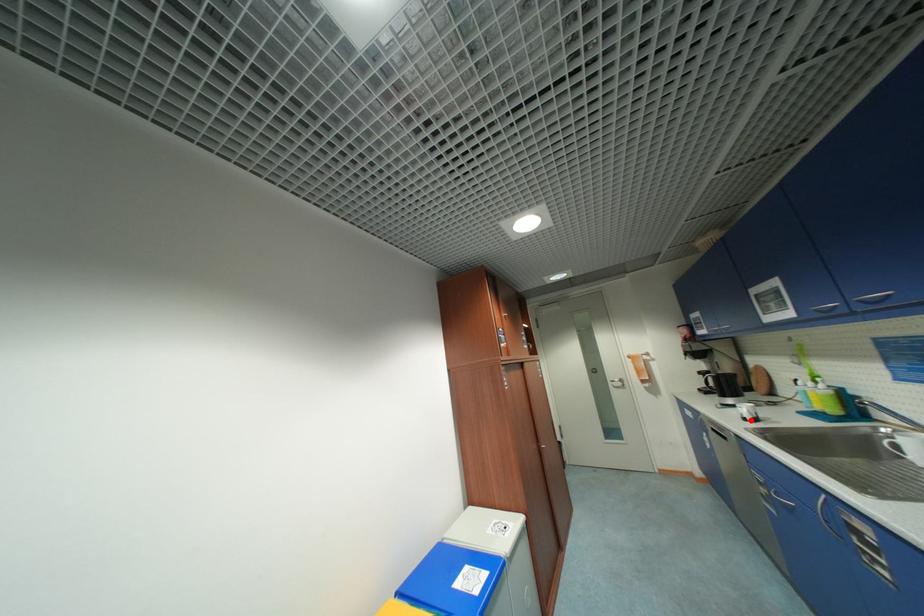
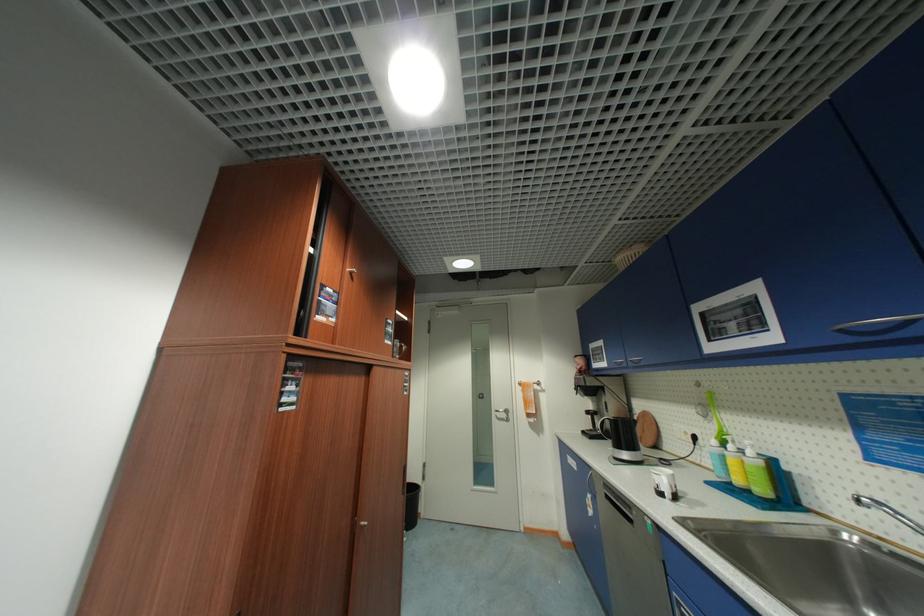
Locate, in the second image, the point that corresponds to the highlighted location in the first image.

(666, 495)